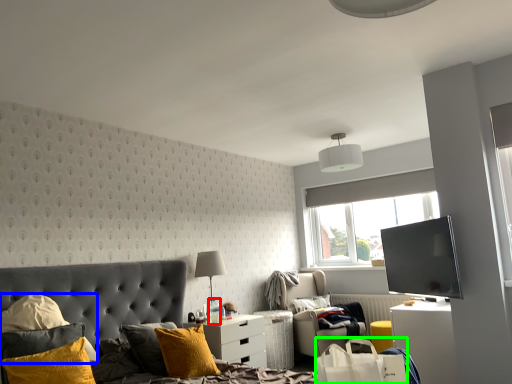
Question: Which object is positioned closest to bottle (highlighted by a red box)? Select from pillow (highlighted by a blue box) and shopping bag (highlighted by a green box).

Choices:
 (A) pillow
 (B) shopping bag

Answer: (A)